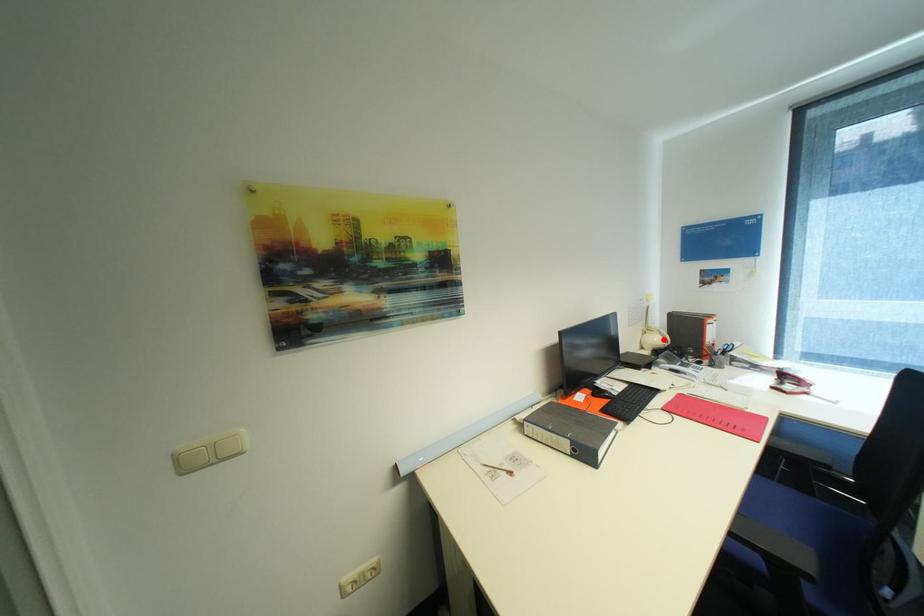
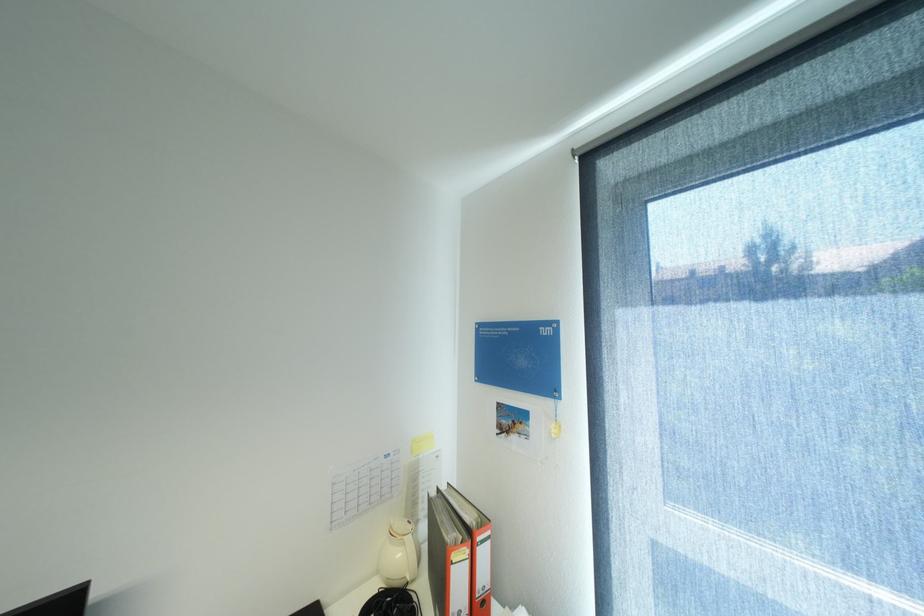
Locate, in the second image, the point that corresponds to the highlighted location in the first image.

(407, 554)